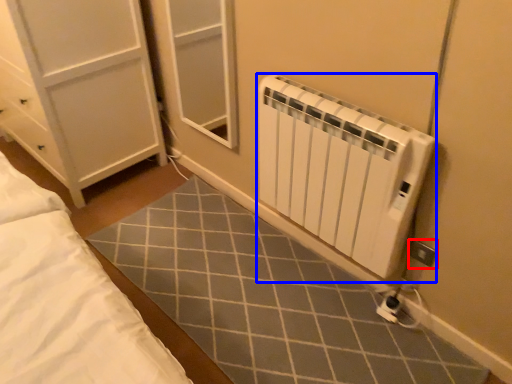
Question: Which object is closer to the camera taking this photo, electric outlet (highlighted by a red box) or radiator (highlighted by a blue box)?

Choices:
 (A) electric outlet
 (B) radiator

Answer: (B)